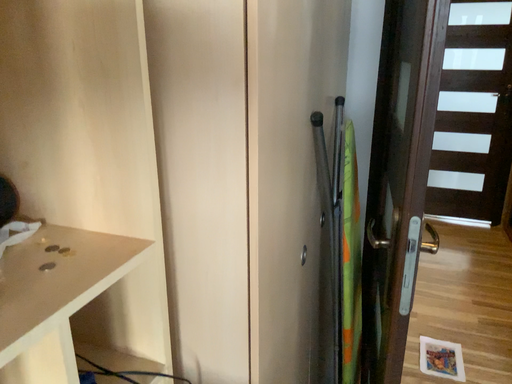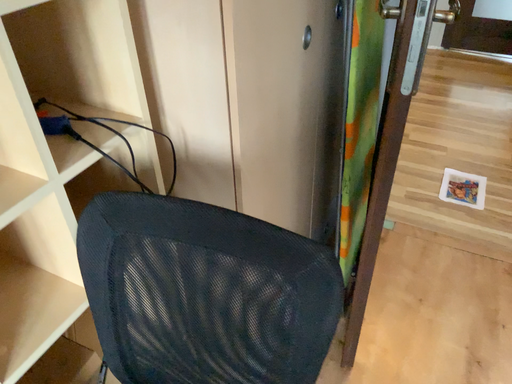
Question: Which way did the camera rotate in the video?

Choices:
 (A) rotated left
 (B) rotated right

Answer: (A)